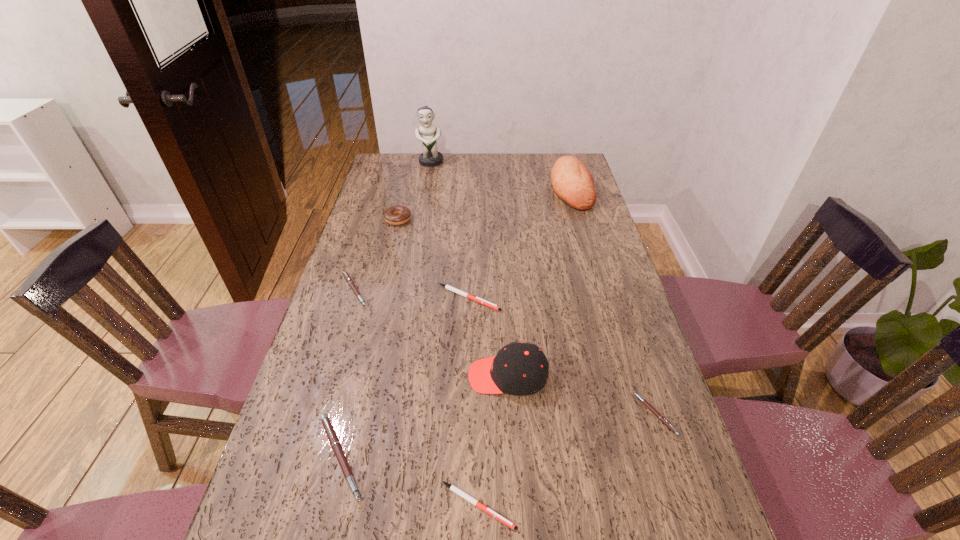
This screenshot has width=960, height=540. Find the location of `blank region between the sixth shortest object and the fifth tallest object`. blank region between the sixth shortest object and the fifth tallest object is located at coordinates (369, 338).

The height and width of the screenshot is (540, 960). Find the location of `free space between the second biggest pink pen and the farther white pen`. free space between the second biggest pink pen and the farther white pen is located at coordinates (411, 294).

This screenshot has width=960, height=540. Identify the location of free spot between the second biggest pink pen and the green figurine. (393, 226).

The width and height of the screenshot is (960, 540). I want to click on object that is the eighth closest one to the bigger white pen, so 430,157.

The width and height of the screenshot is (960, 540). I want to click on the closest object to the smallest pink pen, so click(x=519, y=369).

Select which pen is the fourth closest to the doughnut. Please provide its 2D coordinates. Your answer should be formatted as a tuple, i.e. [(x, y)], where the tuple contains the x and y coordinates of a point satisfying the conditions above.

[(456, 490)]

Select which pen is the fifth closest to the cap. Please provide its 2D coordinates. Your answer should be formatted as a tuple, i.e. [(x, y)], where the tuple contains the x and y coordinates of a point satisfying the conditions above.

[(345, 274)]

At what (x,y) coordinates should I click in order to perform the action: click on the second closest pink pen to the second biggest pink pen. Please return your answer as a coordinate pair (x, y). This screenshot has width=960, height=540. Looking at the image, I should click on (651, 408).

At what (x,y) coordinates should I click in order to perform the action: click on the third closest pink pen to the doughnut. Please return your answer as a coordinate pair (x, y). The image size is (960, 540). Looking at the image, I should click on (651, 408).

Locate an element on the screen. The width and height of the screenshot is (960, 540). white pen that stands as the second closest to the light bread is located at coordinates (456, 490).